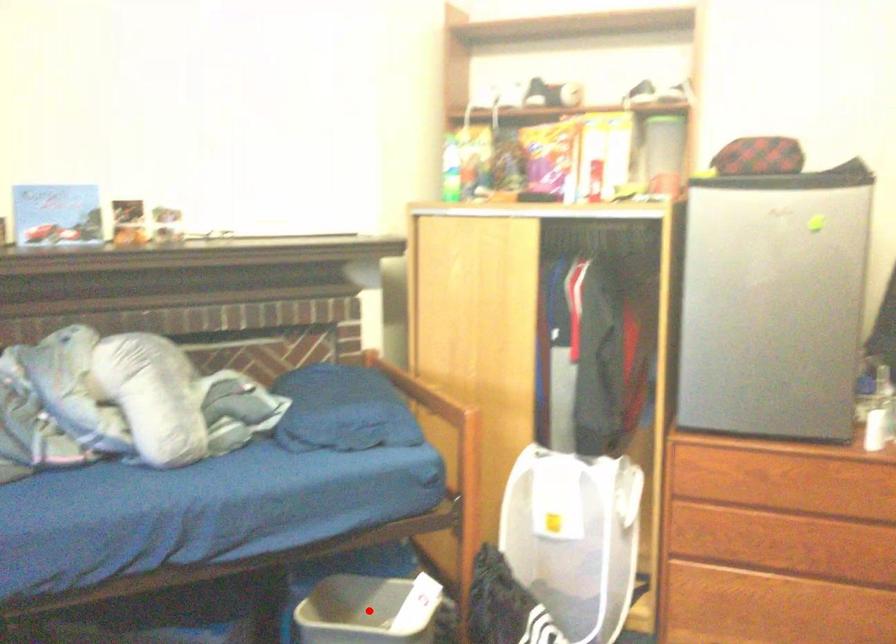
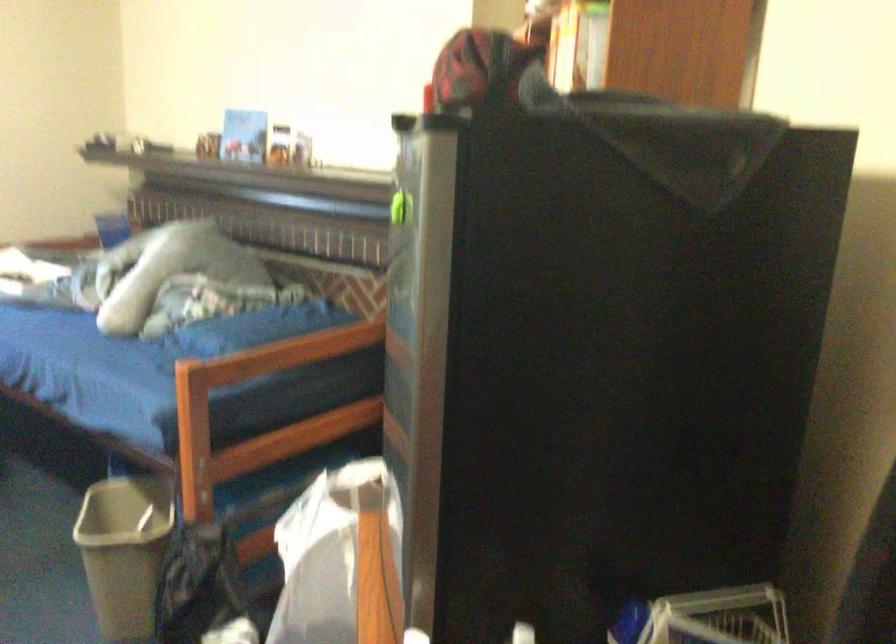
Question: I am providing you with two images of the same scene from different viewpoints. A red point is marked on the first image. Is the red point's position out of view in image 2?

Choices:
 (A) Yes
 (B) No

Answer: (A)